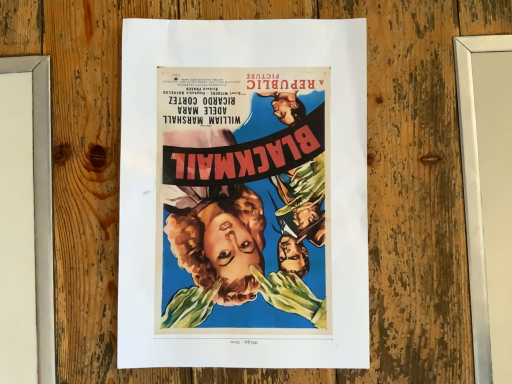
The width and height of the screenshot is (512, 384). Describe the element at coordinates (243, 194) in the screenshot. I see `watercolor paper poster at center` at that location.

Where is `watercolor paper poster at center`? The image size is (512, 384). watercolor paper poster at center is located at coordinates (243, 194).

Identify the location of watercolor paper poster at center. This screenshot has height=384, width=512. (243, 194).